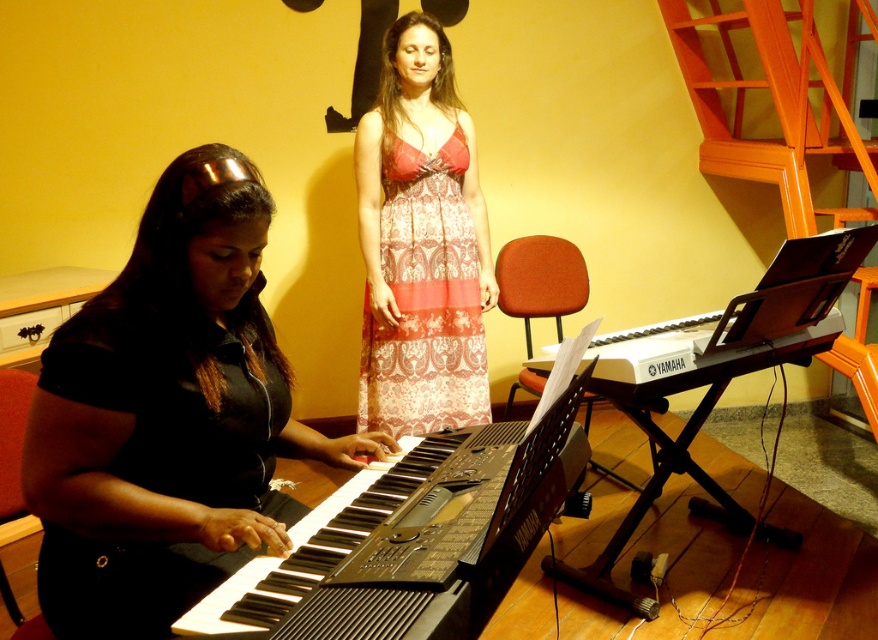
Question: Observing the image, what is the correct spatial positioning of black matte shirt at center in reference to patterned fabric dress at center?

Choices:
 (A) right
 (B) left

Answer: (B)

Question: Which point is closer to the camera?

Choices:
 (A) (373, 493)
 (B) (402, 301)
 (C) (610, 392)
 (D) (52, 582)

Answer: (D)

Question: Which object is farther from the camera taking this photo?

Choices:
 (A) black matte shirt at center
 (B) patterned fabric dress at center
 (C) black plastic keyboard at right
 (D) black plastic keyboard at lower left

Answer: (B)

Question: Is black plastic keyboard at lower left smaller than black plastic keyboard at right?

Choices:
 (A) yes
 (B) no

Answer: (A)

Question: Can you confirm if black plastic keyboard at lower left is positioned above black plastic keyboard at right?

Choices:
 (A) no
 (B) yes

Answer: (A)

Question: Estimate the real-world distances between objects in this image. Which object is closer to the patterned fabric dress at center?

Choices:
 (A) black plastic keyboard at lower left
 (B) black plastic keyboard at right

Answer: (B)